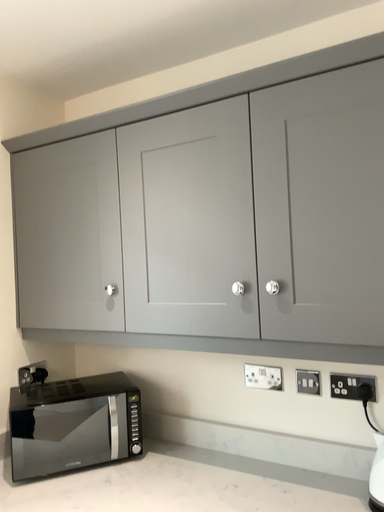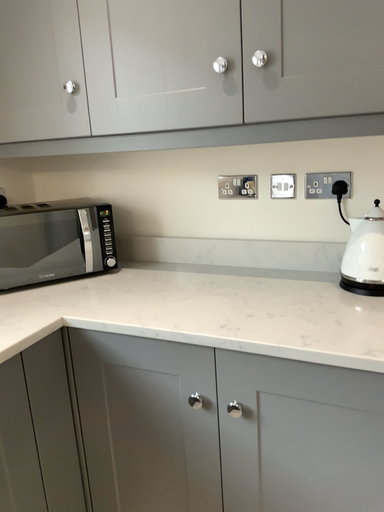
Question: Which way did the camera rotate in the video?

Choices:
 (A) rotated right
 (B) rotated left

Answer: (A)